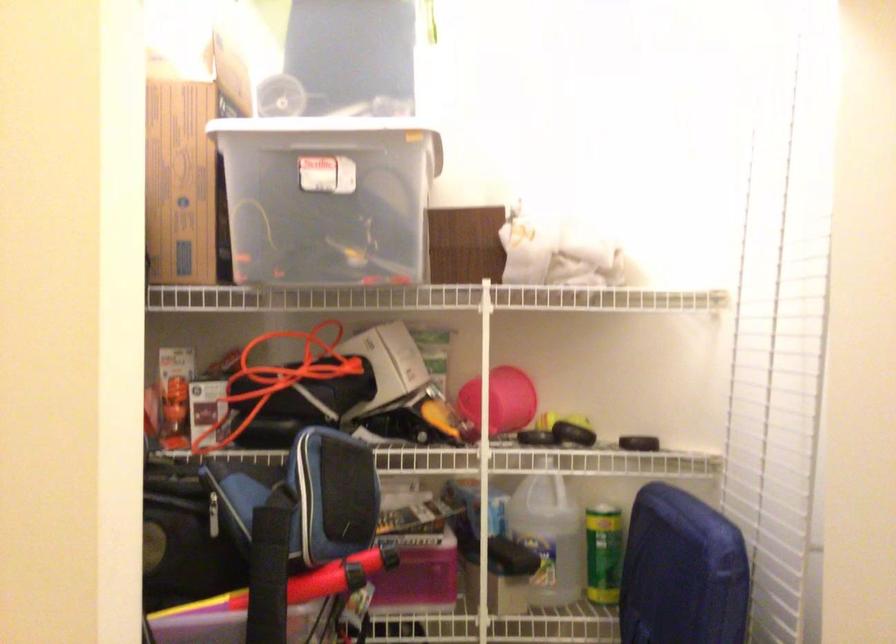
This screenshot has height=644, width=896. What are the coordinates of `blue bag handle` in the screenshot? It's located at (682, 572).